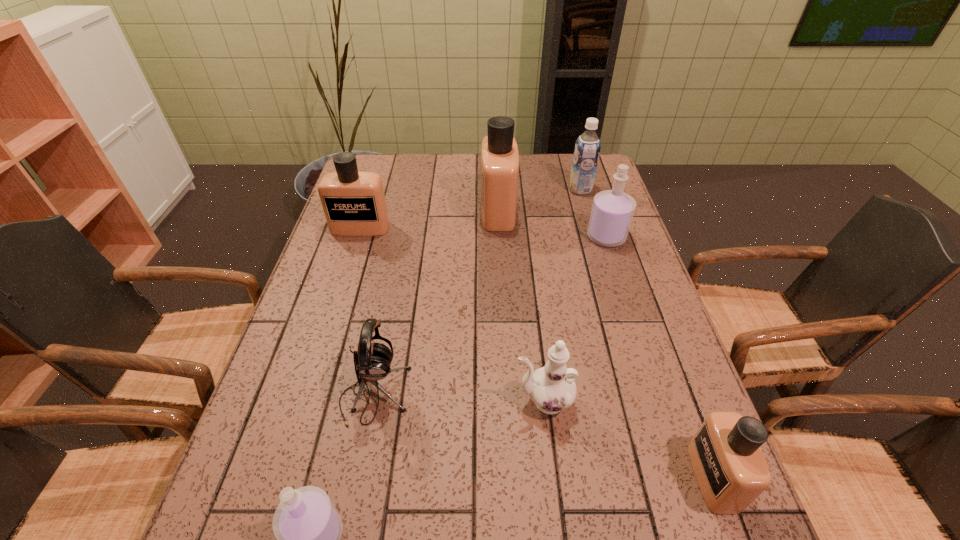
The height and width of the screenshot is (540, 960). Find the location of `free space located on the front label of the third perfume from left to right`. free space located on the front label of the third perfume from left to right is located at coordinates (459, 211).

This screenshot has height=540, width=960. In order to click on vacant position located on the front label of the third perfume from left to right in this screenshot , I will do `click(444, 211)`.

Find the location of `vacant space located on the front label of the third perfume from left to right`. vacant space located on the front label of the third perfume from left to right is located at coordinates (438, 211).

I want to click on vacant space located on the label of the soya milk, so click(499, 190).

Where is `vacant area situated 0.090m on the label of the soya milk`? The image size is (960, 540). vacant area situated 0.090m on the label of the soya milk is located at coordinates (543, 190).

Where is `free region located on the label of the soya milk`? This screenshot has width=960, height=540. free region located on the label of the soya milk is located at coordinates point(528,190).

Find the location of a particular element. The width and height of the screenshot is (960, 540). vacant space situated 0.350m on the left of the farther purple perfume is located at coordinates (470, 237).

You are a GUI agent. You are given a task and a screenshot of the screen. Output one action in this format:
    pyautogui.click(x=<x>, y=<y>)
    Task: Click on the vacant space located on the front label of the leftmost beige perfume
    
    Given the screenshot: What is the action you would take?
    pyautogui.click(x=348, y=268)

At what (x,y) coordinates should I click in order to perform the action: click on vacant space located 0.130m at the spout of the chinaware. Please return your answer as a coordinate pair (x, y). Looking at the image, I should click on (451, 401).

This screenshot has width=960, height=540. In order to click on free point located at the spout of the chinaware in this screenshot , I will do `click(414, 401)`.